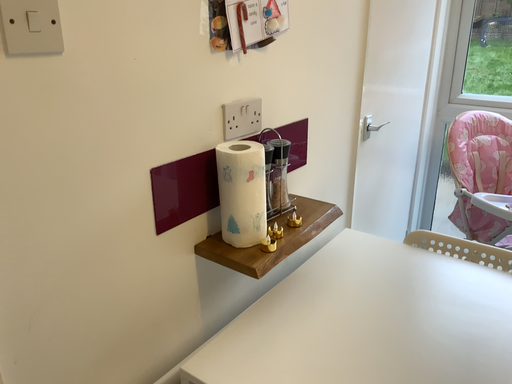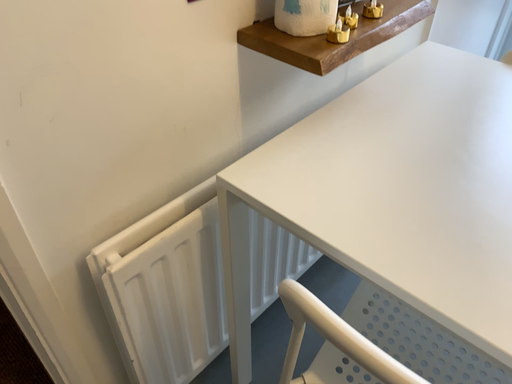
Question: How did the camera likely rotate when shooting the video?

Choices:
 (A) rotated upward
 (B) rotated downward

Answer: (B)